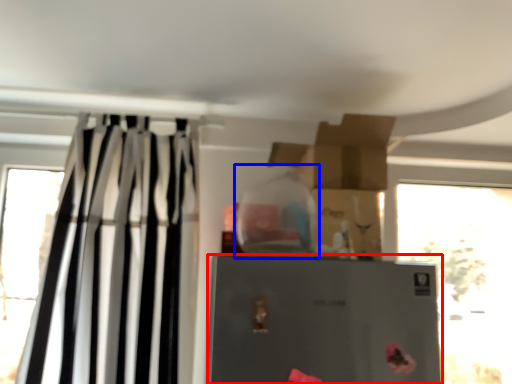
Question: Which of the following is the closest to the observer, refrigerator (highlighted by a red box) or bottle (highlighted by a blue box)?

Choices:
 (A) refrigerator
 (B) bottle

Answer: (A)